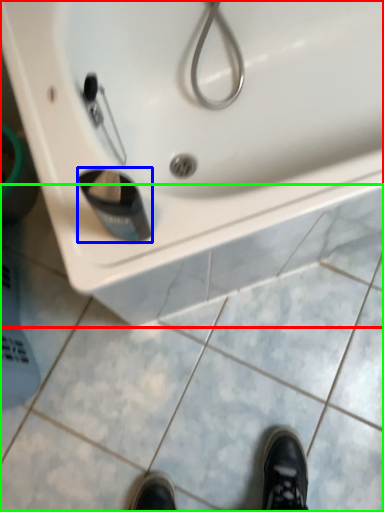
Question: Based on their relative distances, which object is farther from sink (highlighted by a red box)? Choose from liquid (highlighted by a blue box) and tile (highlighted by a green box).

Choices:
 (A) liquid
 (B) tile

Answer: (B)